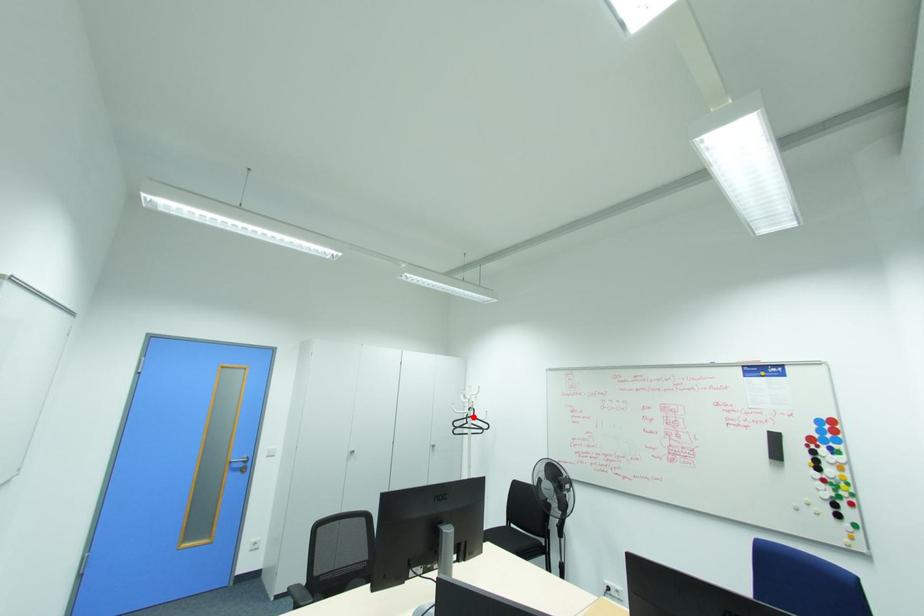
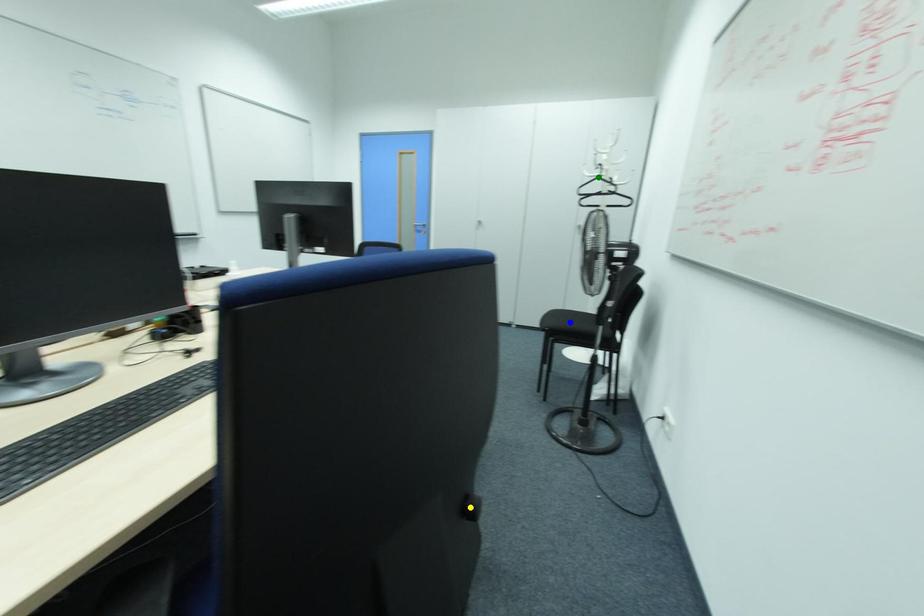
Question: I am providing you with two images of the same scene from different viewpoints. A red point is marked on the first image. You are given multiple points on the second image. In image 2, which mark is for the same physical point as the one in image 1?

Choices:
 (A) blue point
 (B) yellow point
 (C) green point

Answer: (C)